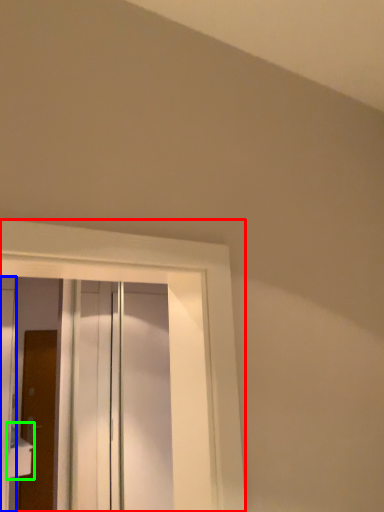
Question: Which is farther away from window (highlighted by a red box)? door (highlighted by a blue box) or sink (highlighted by a green box)?

Choices:
 (A) door
 (B) sink

Answer: (B)